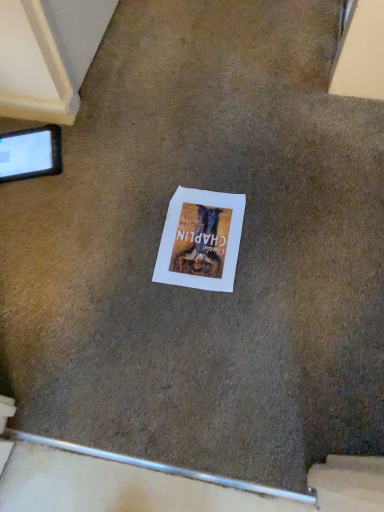
Identify the location of vacant area to the right of white paper at center. (281, 237).